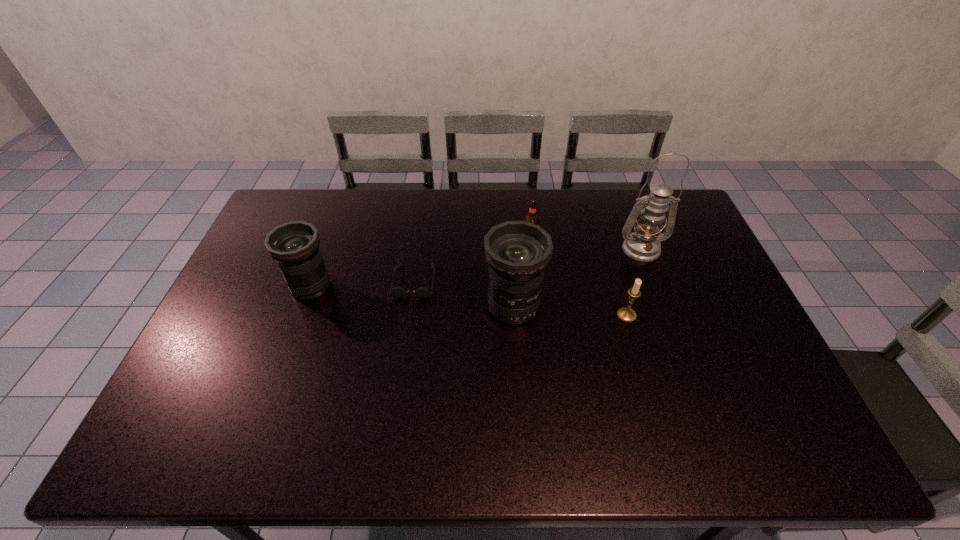
In the image, there is a desktop. Where is `vacant region at the far left corner`? This screenshot has width=960, height=540. vacant region at the far left corner is located at coordinates (287, 218).

What are the coordinates of `vacant region between the sunglasses and the right telephoto lens` in the screenshot? It's located at (464, 294).

Where is `free space between the second object from right to left and the root beer`? The height and width of the screenshot is (540, 960). free space between the second object from right to left and the root beer is located at coordinates (578, 276).

The width and height of the screenshot is (960, 540). Find the location of `free point between the rightmost object and the shorter telephoto lens`. free point between the rightmost object and the shorter telephoto lens is located at coordinates (476, 268).

Where is `empty space between the tallest object and the left telephoto lens`? The height and width of the screenshot is (540, 960). empty space between the tallest object and the left telephoto lens is located at coordinates (476, 268).

Locate an element on the screen. This screenshot has width=960, height=540. free spot between the rightmost object and the root beer is located at coordinates (586, 244).

Identify the location of empty space between the leftmost object and the sunglasses. The image size is (960, 540). (362, 284).

Image resolution: width=960 pixels, height=540 pixels. Identify the location of free space that is in between the taller telephoto lens and the leftmost object. (412, 296).

Find the location of a particular element. vacant space in between the tallest object and the fifth object from left to right is located at coordinates (634, 282).

This screenshot has width=960, height=540. In order to click on vacant area that lies between the left telephoto lens and the candle holder in this screenshot , I will do `click(468, 301)`.